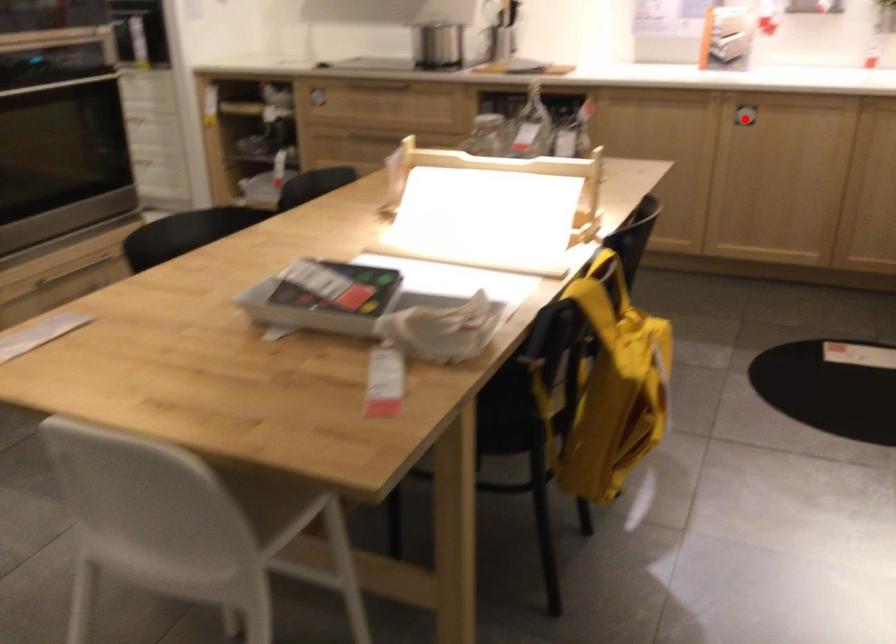
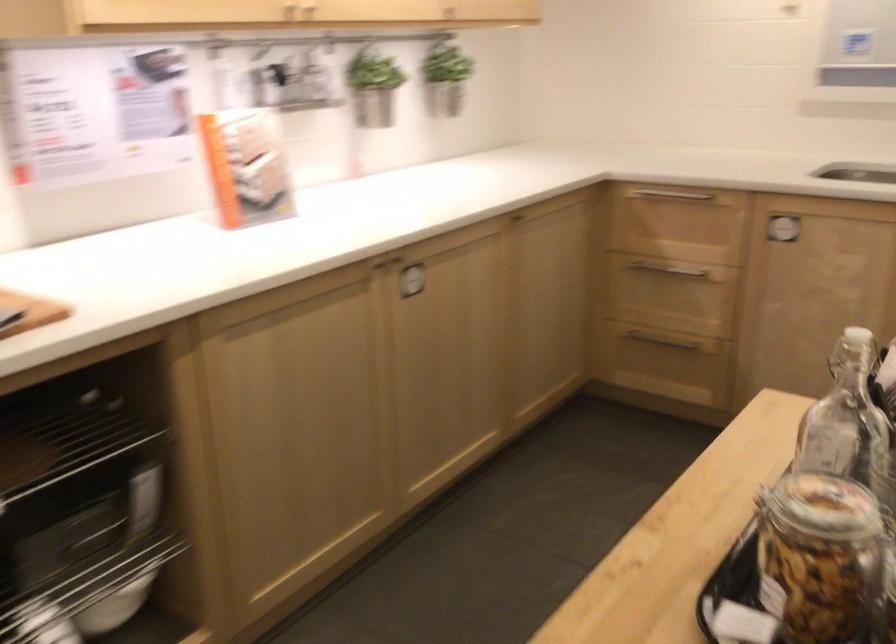
Question: I am providing you with two images of the same scene from different viewpoints. A red point is marked on the first image. Is the red point's position out of view in image 2?

Choices:
 (A) Yes
 (B) No

Answer: (A)